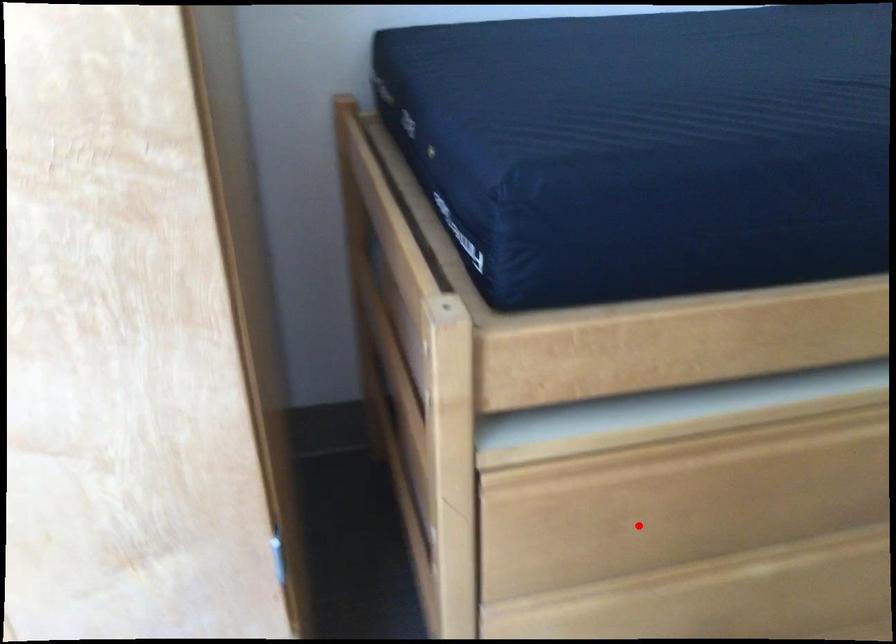
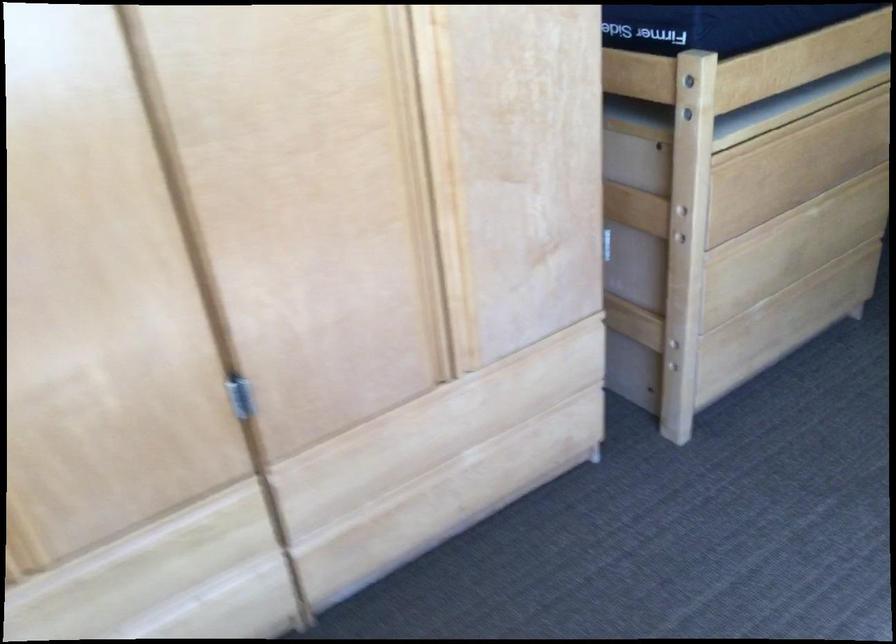
Question: I am providing you with two images of the same scene from different viewpoints. In image1, a red point is highlighted. Considering the same 3D point in image2, which of the following is correct?

Choices:
 (A) It is closer
 (B) It is farther

Answer: (B)